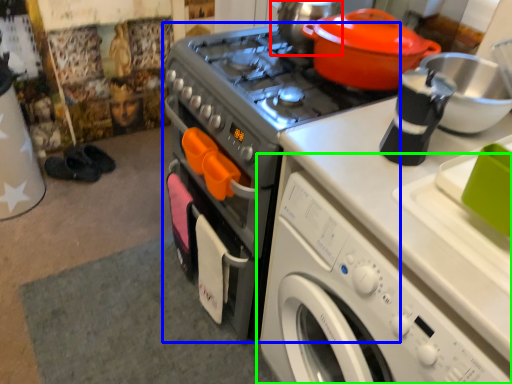
Question: Estimate the real-world distances between objects in this image. Which object is closer to tea pot (highlighted by a red box), home appliance (highlighted by a blue box) or washing machine (highlighted by a green box)?

Choices:
 (A) home appliance
 (B) washing machine

Answer: (A)